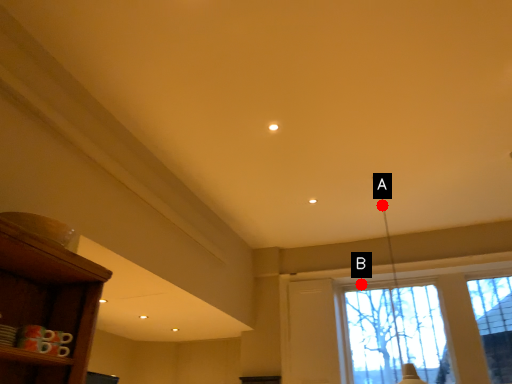
Question: Two points are circled on the image, labeled by A and B beside each circle. Which point is closer to the camera?

Choices:
 (A) A is closer
 (B) B is closer

Answer: (A)